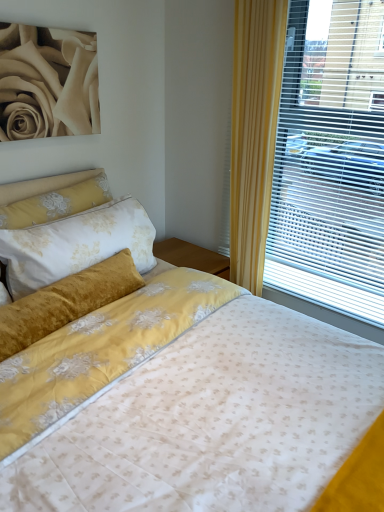
Question: Visually, is velvet yellow pillow at upper left positioned to the left or to the right of matte blinds at right?

Choices:
 (A) right
 (B) left

Answer: (B)

Question: Considering the positions of point (46, 179) and point (301, 86), is point (46, 179) closer or farther from the camera than point (301, 86)?

Choices:
 (A) farther
 (B) closer

Answer: (A)

Question: Which object is the farthest from the matte cream rose at upper left?

Choices:
 (A) velvet yellow pillow at upper left
 (B) matte blinds at right

Answer: (B)

Question: Which object is the closest to the matte cream rose at upper left?

Choices:
 (A) matte blinds at right
 (B) velvet yellow pillow at upper left

Answer: (B)